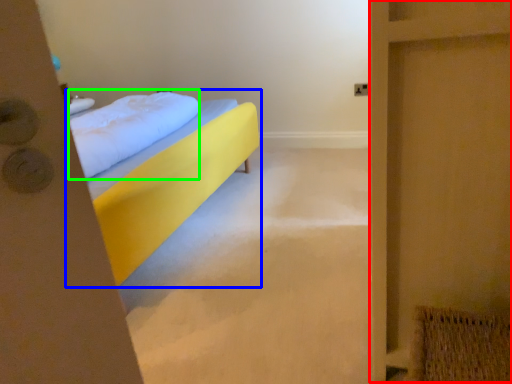
Question: Which object is the farthest from screen door (highlighted by a red box)? Choose among these: bed (highlighted by a blue box) or pillow (highlighted by a green box).

Choices:
 (A) bed
 (B) pillow

Answer: (B)